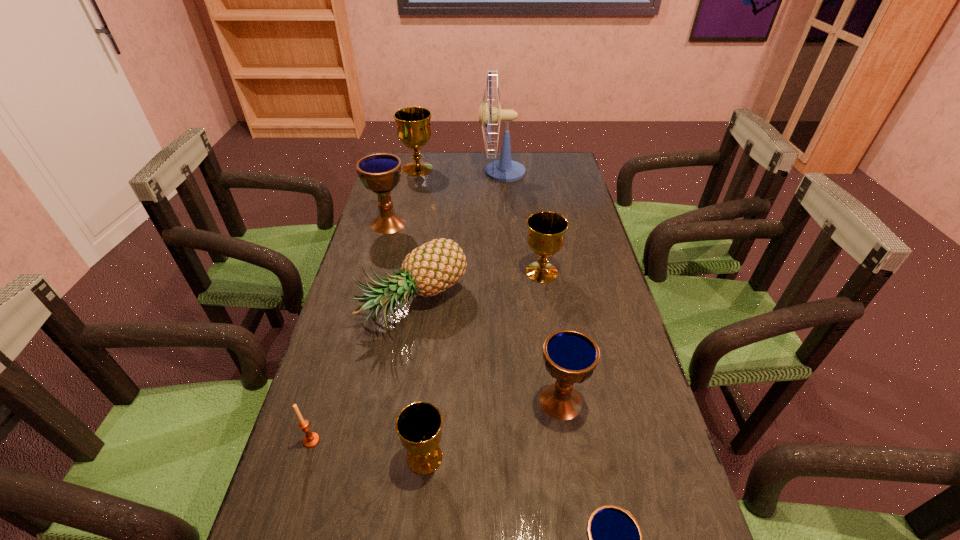
This screenshot has height=540, width=960. I want to click on pineapple, so (435, 266).

You are a GUI agent. You are given a task and a screenshot of the screen. Output one action in this format:
    pyautogui.click(x=<x>, y=<y>)
    Task: Click on the second nearest chalice
    
    Given the screenshot: What is the action you would take?
    pyautogui.click(x=419, y=424)

I want to click on the fourth chalice from right to left, so tap(419, 424).

Identify the location of candle_holder. (311, 439).

Where is `blank area located 0.100m at the front of the blue fan where the blades are visible`? The width and height of the screenshot is (960, 540). blank area located 0.100m at the front of the blue fan where the blades are visible is located at coordinates (454, 172).

Where is `free space located 0.370m at the front of the blue fan where the blades are visible`? The image size is (960, 540). free space located 0.370m at the front of the blue fan where the blades are visible is located at coordinates (387, 172).

Locate an element on the screen. This screenshot has height=540, width=960. vacant region located at the front of the blue fan where the blades are visible is located at coordinates (454, 172).

You are a GUI agent. You are given a task and a screenshot of the screen. Output one action in this format:
    pyautogui.click(x=<x>, y=<y>)
    Task: Click on the free location located on the front of the farthest chalice
    Image resolution: width=960 pixels, height=540 pixels.
    Given the screenshot: What is the action you would take?
    pyautogui.click(x=408, y=215)

Where is `vacant space located on the back of the seventh nearest object`? The image size is (960, 540). vacant space located on the back of the seventh nearest object is located at coordinates click(x=400, y=180).

In order to click on free location located 0.110m on the back of the second nearest gold chalice in this screenshot , I will do point(537,239).